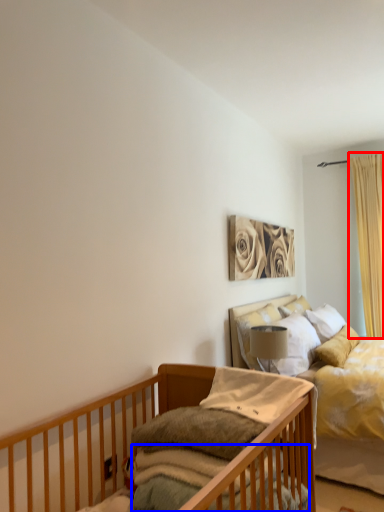
Question: Which object appears closest to the camera in this image, curtain (highlighted by a red box) or mattress (highlighted by a blue box)?

Choices:
 (A) curtain
 (B) mattress

Answer: (B)